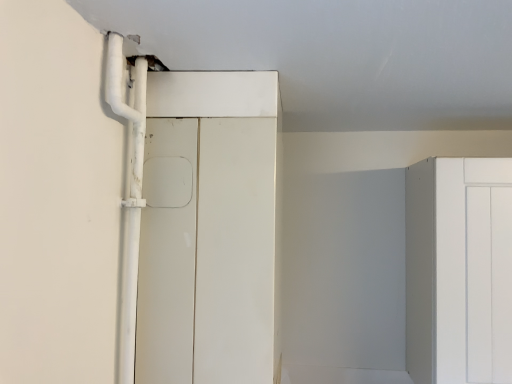
Question: From the image's perspective, is white matte door at center beneath white plastic pipe at left?

Choices:
 (A) yes
 (B) no

Answer: (A)

Question: From a real-world perspective, is white matte door at center positioned under white plastic pipe at left based on gravity?

Choices:
 (A) yes
 (B) no

Answer: (A)

Question: Does white matte door at center have a lesser height compared to white plastic pipe at left?

Choices:
 (A) no
 (B) yes

Answer: (A)

Question: Could you tell me if white matte door at center is facing white plastic pipe at left?

Choices:
 (A) no
 (B) yes

Answer: (A)

Question: Does white matte door at center have a smaller size compared to white plastic pipe at left?

Choices:
 (A) yes
 (B) no

Answer: (B)

Question: Is white matte door at center positioned far away from white plastic pipe at left?

Choices:
 (A) yes
 (B) no

Answer: (B)

Question: Does white plastic pipe at left touch white matte door at center?

Choices:
 (A) yes
 (B) no

Answer: (B)

Question: Considering the relative sizes of white plastic pipe at left and white matte door at center in the image provided, is white plastic pipe at left thinner than white matte door at center?

Choices:
 (A) no
 (B) yes

Answer: (B)

Question: From the image's perspective, would you say white plastic pipe at left is positioned over white matte door at center?

Choices:
 (A) yes
 (B) no

Answer: (A)

Question: From a real-world perspective, is white plastic pipe at left physically above white matte door at center?

Choices:
 (A) yes
 (B) no

Answer: (A)

Question: Can you confirm if white plastic pipe at left is wider than white matte door at center?

Choices:
 (A) no
 (B) yes

Answer: (A)

Question: Is white plastic pipe at left not within white matte door at center?

Choices:
 (A) no
 (B) yes

Answer: (B)

Question: Is white plastic pipe at left wider or thinner than white matte door at center?

Choices:
 (A) thin
 (B) wide

Answer: (A)